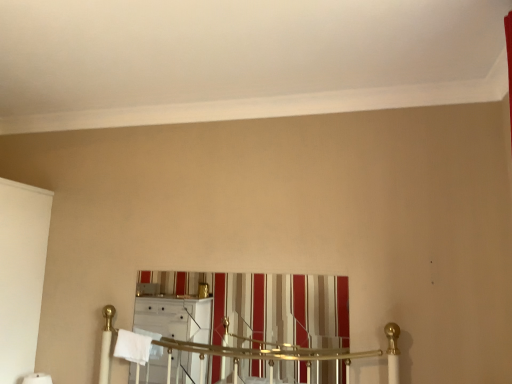
Where is `vacant area on top of striped fabric curtain at center (from a real-world perspective)`? The width and height of the screenshot is (512, 384). vacant area on top of striped fabric curtain at center (from a real-world perspective) is located at coordinates (226, 271).